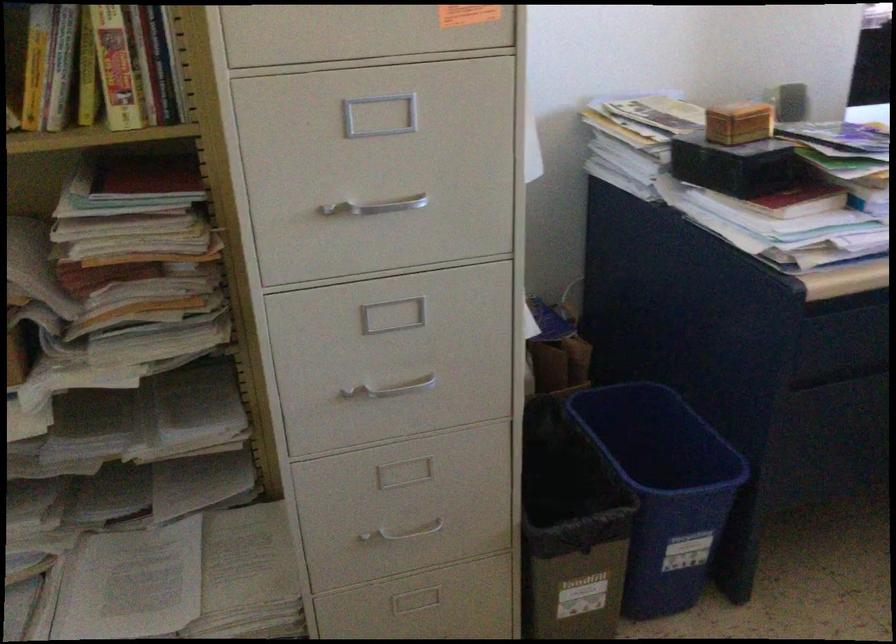
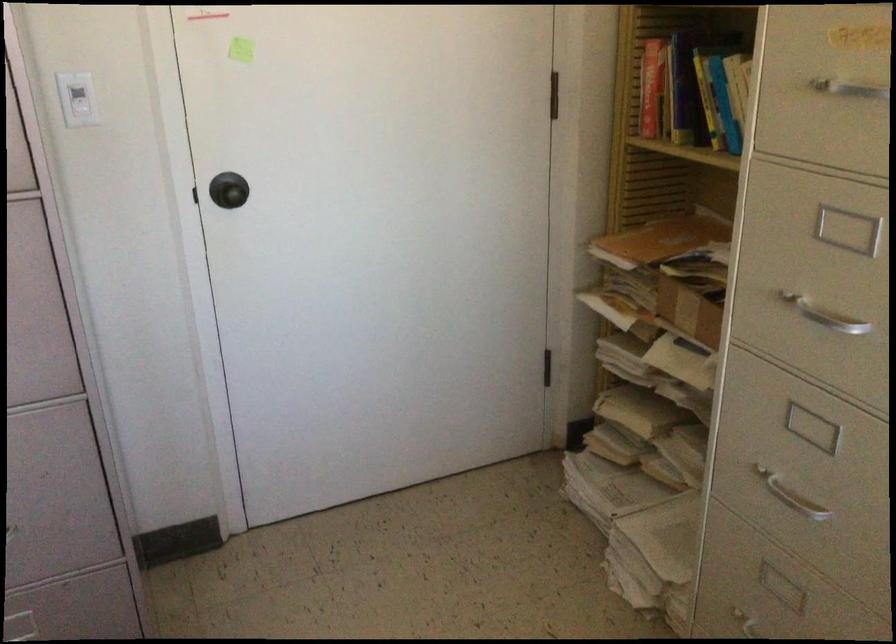
Find the pixel in the second image that matches point (398, 382) in the first image.

(790, 496)